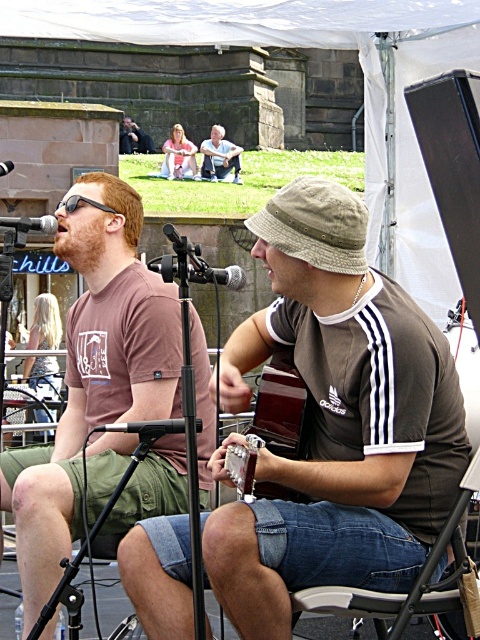
You are a photographer positioned behind the musicians and want to capture a shot of the black matte microphone at center. To do so, you need to move around the denim fabric folding chair at lower center. Is the chair blocking your path to the microphone?

The denim fabric folding chair at lower center is to the right of the black matte microphone at center. Therefore, the chair is not directly in front of the microphone, so moving around it should allow you to access the microphone without obstruction.

You are a photographer standing at the camera position. You want to capture a closeup shot of the denim fabric folding chair at lower center. Given that your camera can focus on objects within 40 feet, will you be able to get a clear closeup?

Answer: The denim fabric folding chair at lower center is 42.28 feet away from the camera, which is beyond the camera focus range of 40 feet. Therefore, you won